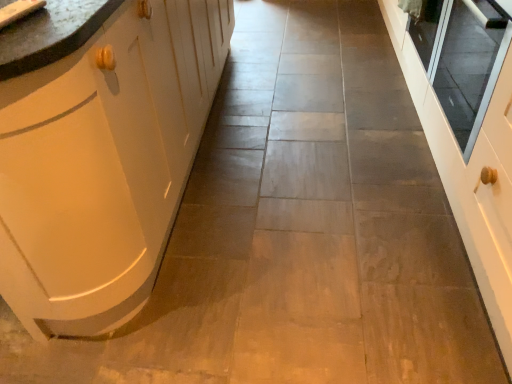
What do you see at coordinates (461, 57) in the screenshot?
I see `transparent glass door at right` at bounding box center [461, 57].

What do you see at coordinates (104, 163) in the screenshot? I see `matte white cabinet at left` at bounding box center [104, 163].

At what (x,y) coordinates should I click in order to perform the action: click on transparent glass door at right. Please return your answer as a coordinate pair (x, y). The image size is (512, 384). Looking at the image, I should click on (461, 57).

This screenshot has width=512, height=384. What are the coordinates of `cabinetry that appears above the matte white sink at upper left (from the image's perspective)` in the screenshot? It's located at (104, 163).

Can you confirm if matte white sink at upper left is taller than matte white cabinet at left?

No.

From a real-world perspective, is matte white sink at upper left physically located above or below matte white cabinet at left?

matte white sink at upper left is situated higher than matte white cabinet at left in the real world.

Is point (1, 9) in front of point (6, 245)?

Yes.

Is matte white cabinet at left wider or thinner than transparent glass door at right?

Considering their sizes, matte white cabinet at left looks broader than transparent glass door at right.

Consider the image. From a real-world perspective, between matte white cabinet at left and transparent glass door at right, who is vertically lower?

matte white cabinet at left, from a real-world perspective.

Is transparent glass door at right completely or partially inside matte white cabinet at left?

No, transparent glass door at right is not inside matte white cabinet at left.

Is matte white cabinet at left facing towards transparent glass door at right?

No, matte white cabinet at left does not turn towards transparent glass door at right.

Is matte white cabinet at left facing towards matte white sink at upper left?

No, matte white cabinet at left is not facing towards matte white sink at upper left.

How different are the orientations of matte white cabinet at left and matte white sink at upper left in degrees?

matte white cabinet at left and matte white sink at upper left are facing 77.6 degrees away from each other.

From the image's perspective, is matte white cabinet at left positioned above or below matte white sink at upper left?

From the image's perspective, matte white cabinet at left appears above matte white sink at upper left.

Is matte white cabinet at left not close to matte white sink at upper left?

No, matte white cabinet at left is not far from matte white sink at upper left.

Identify the location of window screen that appears behind the matte white sink at upper left. The image size is (512, 384). (461, 57).

Which of these two, matte white sink at upper left or transparent glass door at right, is smaller?

With smaller size is matte white sink at upper left.

Is matte white sink at upper left looking in the opposite direction of transparent glass door at right?

matte white sink at upper left is not turned away from transparent glass door at right.

Considering the sizes of objects matte white sink at upper left and transparent glass door at right in the image provided, who is shorter, matte white sink at upper left or transparent glass door at right?

Standing shorter between the two is matte white sink at upper left.

Is transparent glass door at right in contact with matte white cabinet at left?

transparent glass door at right is not next to matte white cabinet at left, and they're not touching.

From a real-world perspective, is transparent glass door at right under matte white cabinet at left?

Actually, transparent glass door at right is physically above matte white cabinet at left in the real world.

Who is smaller, transparent glass door at right or matte white cabinet at left?

With smaller size is transparent glass door at right.

Considering the positions of point (431, 44) and point (25, 11), is point (431, 44) closer or farther from the camera than point (25, 11)?

Point (431, 44) is farther from the camera than point (25, 11).

From a real-world perspective, is transparent glass door at right positioned above or below matte white sink at upper left?

transparent glass door at right is situated lower than matte white sink at upper left in the real world.

Is matte white sink at upper left inside transparent glass door at right?

No, matte white sink at upper left is not surrounded by transparent glass door at right.

Identify the location of sink behind the matte white cabinet at left. (18, 10).

This screenshot has height=384, width=512. Identify the location of cabinetry that appears below the transparent glass door at right (from a real-world perspective). (104, 163).

Estimate the real-world distances between objects in this image. Which object is closer to matte white cabinet at left, transparent glass door at right or matte white sink at upper left?

matte white sink at upper left is closer to matte white cabinet at left.

Which object lies further to the anchor point matte white cabinet at left, matte white sink at upper left or transparent glass door at right?

transparent glass door at right is further to matte white cabinet at left.

Estimate the real-world distances between objects in this image. Which object is closer to transparent glass door at right, matte white sink at upper left or matte white cabinet at left?

matte white cabinet at left lies closer to transparent glass door at right than the other object.

From the picture: Estimate the real-world distances between objects in this image. Which object is further from transparent glass door at right, matte white cabinet at left or matte white sink at upper left?

The object further to transparent glass door at right is matte white sink at upper left.

Considering their positions, is transparent glass door at right positioned further to matte white sink at upper left than matte white cabinet at left?

transparent glass door at right.

Based on their spatial positions, is matte white cabinet at left or transparent glass door at right closer to matte white sink at upper left?

matte white cabinet at left is closer to matte white sink at upper left.

What are the coordinates of `sink between matte white cabinet at left and transparent glass door at right from left to right` in the screenshot? It's located at (18, 10).